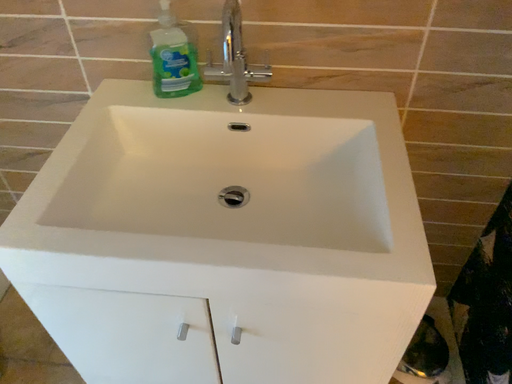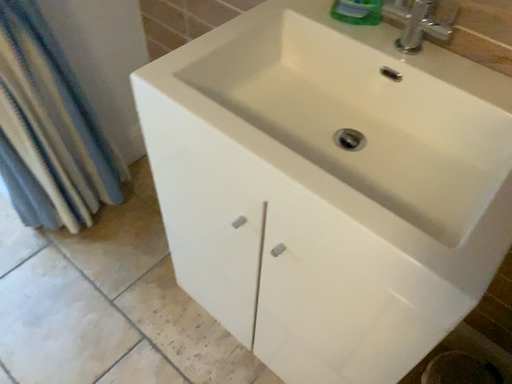
Question: How did the camera likely rotate when shooting the video?

Choices:
 (A) rotated left
 (B) rotated right

Answer: (A)